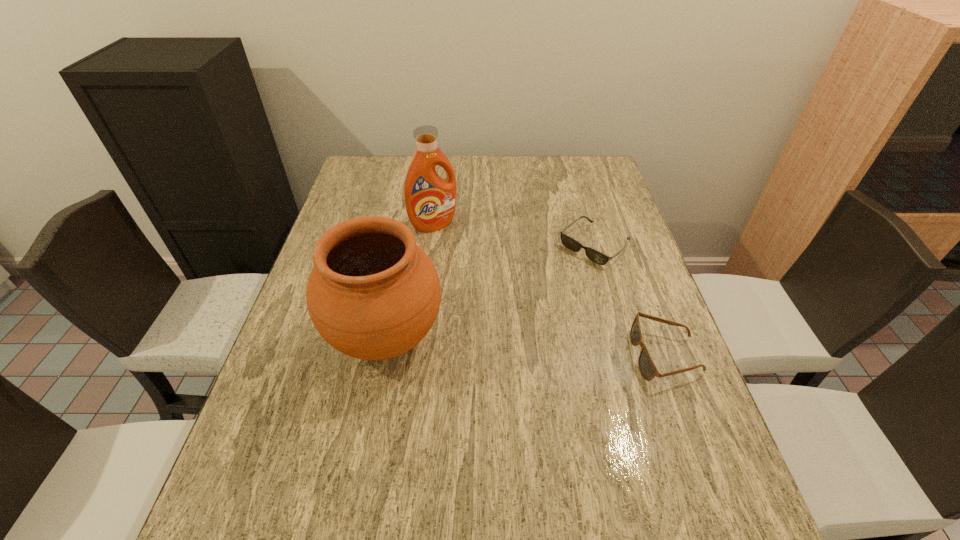
At what (x,y) coordinates should I click in order to perform the action: click on vacant area at the right edge of the desktop. Please return your answer as a coordinate pair (x, y). This screenshot has width=960, height=540. Looking at the image, I should click on (578, 237).

Where is `vacant space at the far left corner of the desktop`? The height and width of the screenshot is (540, 960). vacant space at the far left corner of the desktop is located at coordinates (374, 164).

Find the location of a particular element. Image resolution: width=960 pixels, height=540 pixels. free space at the far right corner is located at coordinates (597, 173).

Find the location of `vacant position at the near right corner of the desktop`. vacant position at the near right corner of the desktop is located at coordinates (653, 442).

I want to click on vacant space in between the nearer sunglasses and the detergent, so click(x=550, y=290).

I want to click on vacant area between the nearer sunglasses and the shortest object, so click(x=630, y=300).

Locate an element on the screen. Image resolution: width=960 pixels, height=540 pixels. vacant point located between the pottery and the second shortest object is located at coordinates (526, 347).

At what (x,y) coordinates should I click in order to perform the action: click on free space between the detergent and the shortest object. Please return your answer as a coordinate pair (x, y). Looking at the image, I should click on (514, 235).

The image size is (960, 540). Find the location of `empty space between the shorter sunglasses and the detergent`. empty space between the shorter sunglasses and the detergent is located at coordinates (514, 235).

At what (x,y) coordinates should I click in order to perform the action: click on vacant space that's between the shortest object and the detergent. Please return your answer as a coordinate pair (x, y). Looking at the image, I should click on (514, 235).